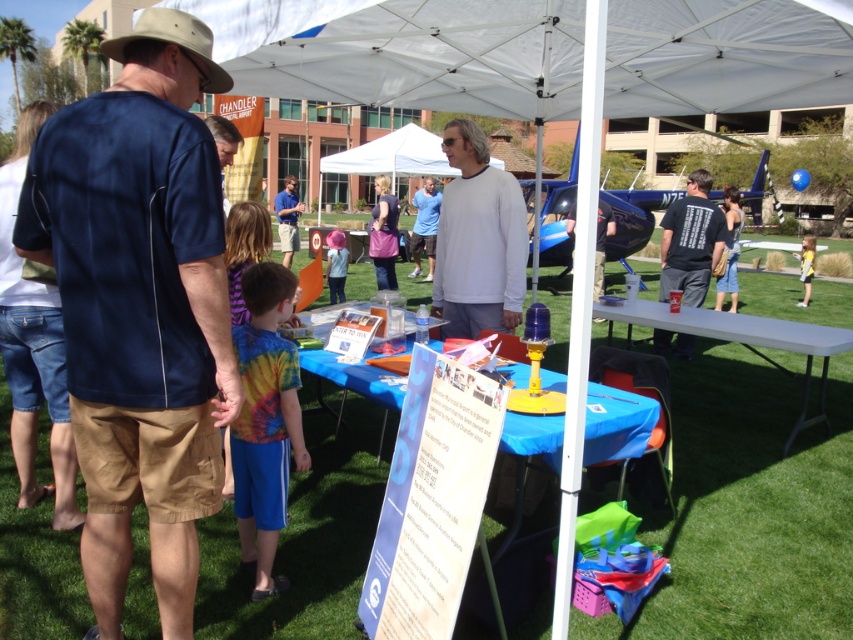
Looking at this image, you are standing at the position of point (697,232) and want to move towards the entrance of the event area. There is a point at (753,342) in your path. Is this point in front of you or behind you?

The point at (753,342) is in front of point (697,232), so it is in front of you.